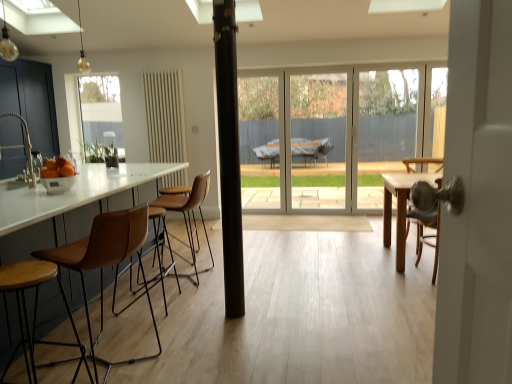
Locate an element on the screen. free area in between brown leather stool at left and black matte pole at center is located at coordinates (184, 327).